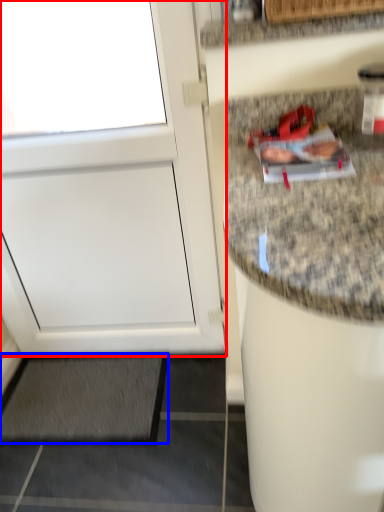
Question: Which point is further to the camera, door (highlighted by a red box) or mat (highlighted by a blue box)?

Choices:
 (A) door
 (B) mat

Answer: (B)